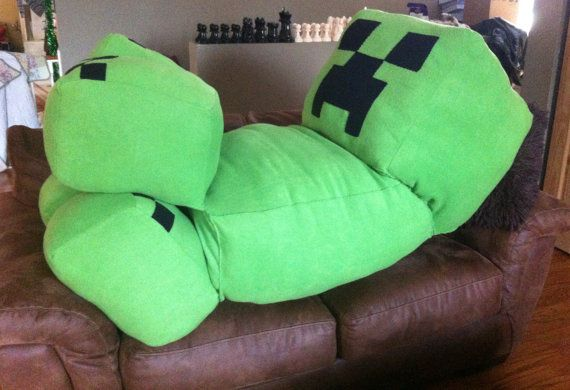
Locate where people rest their arms when sitting on the couch in the image. Your answer should be formatted as a list of tuples, i.e. [(x1, y1), (x2, y2), ...], where each tuple contains the x and y coordinates of a point satisfying the conditions above.

[(21, 272), (527, 199)]